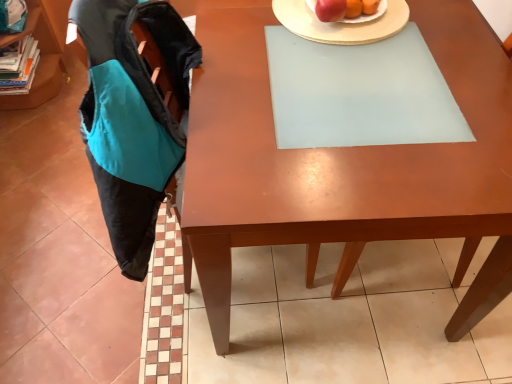
This screenshot has height=384, width=512. Identify the location of vacant space to the right of white ceramic plate at upper center. (454, 29).